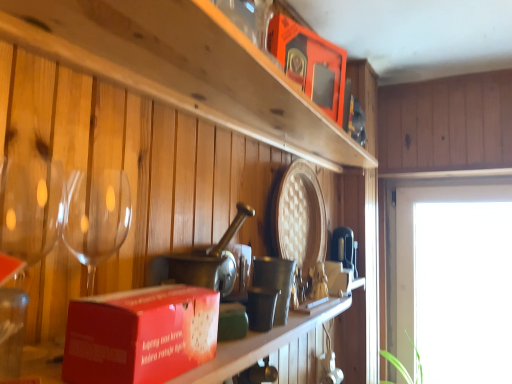
Question: From the image's perspective, is wooden shelf at upper center located above or below matte orange box at upper center, placed as the 1th box when sorted from right to left?

Choices:
 (A) below
 (B) above

Answer: (A)

Question: Is wooden shelf at upper center to the left or to the right of matte orange box at upper center, which is the first box in top-to-bottom order, in the image?

Choices:
 (A) right
 (B) left

Answer: (B)

Question: Which is nearer to the metallic silver cup at center?

Choices:
 (A) transparent glass window at right
 (B) red cardboard box at center, the 2th box positioned from the top
 (C) matte orange box at upper center, which is the first box from back to front
 (D) matte red box at lower left
 (E) wooden shelf at upper center

Answer: (D)

Question: Which object is positioned farthest from the matte orange box at upper center, which is the first box from back to front?

Choices:
 (A) wooden shelf at upper center
 (B) transparent glass window at right
 (C) red cardboard box at center, acting as the 1th box starting from the front
 (D) matte red box at lower left
 (E) transparent glass wine glass at left

Answer: (B)